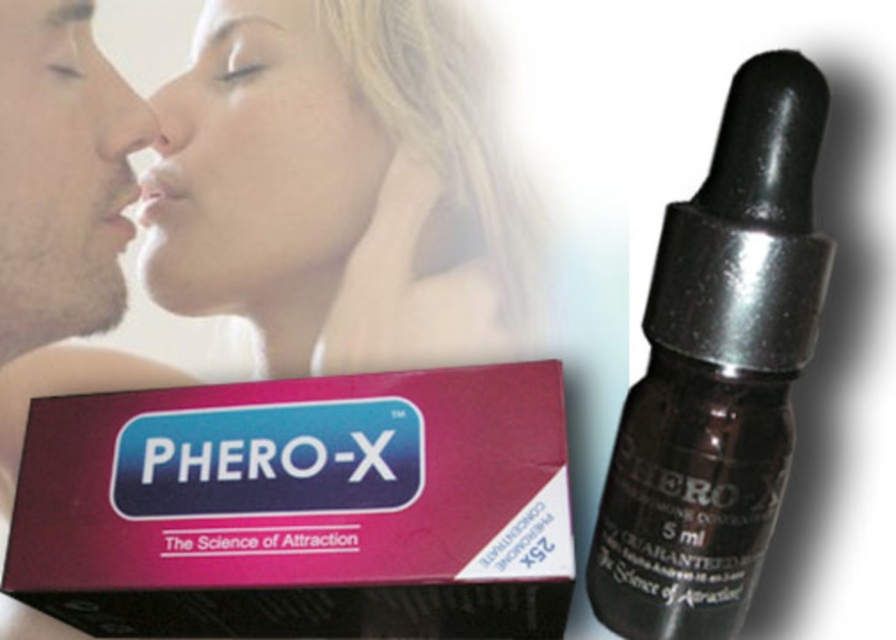
Question: Which object appears farthest from the camera in this image?

Choices:
 (A) transparent glass dropper at center
 (B) matte pink lipstick at center

Answer: (B)

Question: Which point is closer to the camera?

Choices:
 (A) matte black face at left
 (B) matte skin nose at center
 (C) matte pink skin at center

Answer: (A)

Question: Can you confirm if matte pink box at upper left is positioned above matte skin nose at center?

Choices:
 (A) no
 (B) yes

Answer: (A)

Question: Which object appears closest to the camera in this image?

Choices:
 (A) matte pink skin at center
 (B) matte skin nose at center
 (C) matte pink lipstick at center

Answer: (A)

Question: Is matte pink box at upper left bigger than matte pink skin at center?

Choices:
 (A) yes
 (B) no

Answer: (A)

Question: Can you confirm if matte black face at left is positioned above matte black nose at upper left?

Choices:
 (A) yes
 (B) no

Answer: (B)